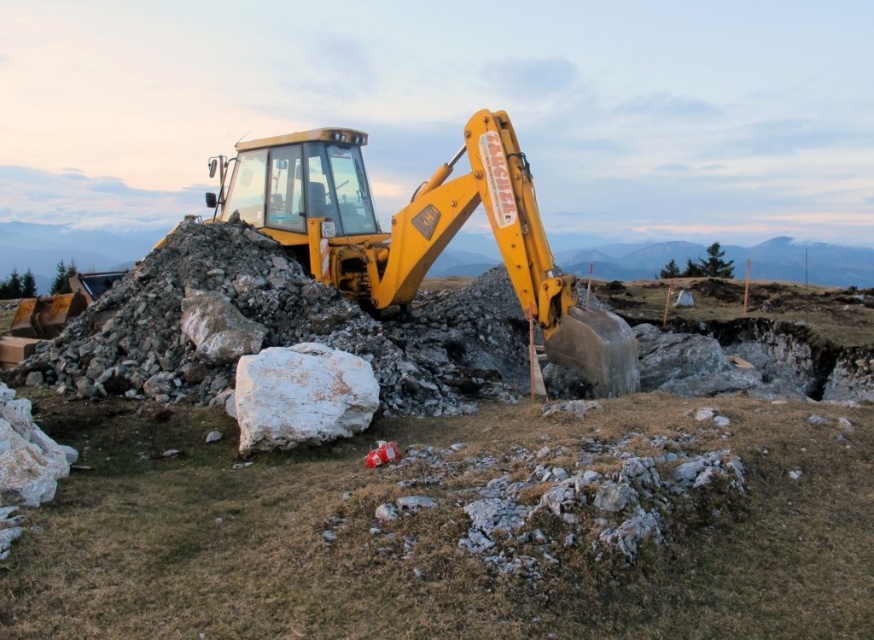
You are a construction worker who needs to move a heavy load from the upper center to the center of the site. The yellow metallic excavator at upper center and the yellow metallic tractor at center are available. Which machine should you use to ensure the load reaches the center without obstruction?

The yellow metallic excavator at upper center is below the yellow metallic tractor at center, so you should use the yellow metallic tractor at center to move the load from the upper center to the center as it is positioned higher and can access the area without obstruction.

You are a construction worker standing at the point labeled as point (446,529). You need to move to the yellow backhoe loader in the foreground. Which direction should you walk to reach it?

The point (446,529) is on the yellow metallic excavator at upper center, so to reach the yellow backhoe loader in the foreground, you should walk downward towards it since the excavator is higher up.